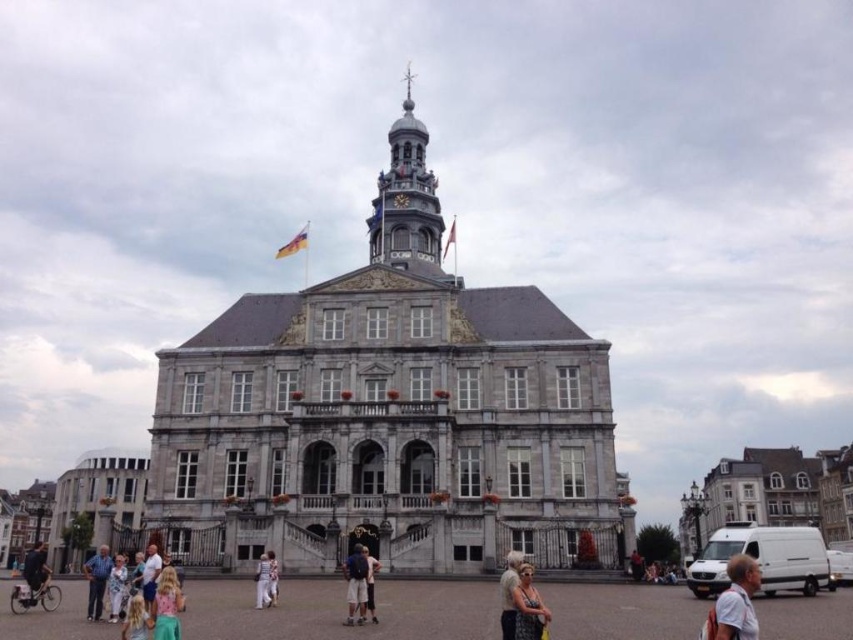
Between dark gray textured dress at lower center and light blue denim jeans at lower left, which one has more height?

light blue denim jeans at lower left is taller.

Between point (532, 627) and point (96, 589), which one is positioned in front?

Positioned in front is point (532, 627).

At what (x,y) coordinates should I click in order to perform the action: click on dark gray textured dress at lower center. Please return your answer as a coordinate pair (x, y). The height and width of the screenshot is (640, 853). Looking at the image, I should click on (527, 608).

Is point (515, 618) farther from camera compared to point (36, 582)?

No, (515, 618) is closer to viewer.

Who is more distant from viewer, (541, 637) or (30, 596)?

The point (30, 596) is more distant.

You are a GUI agent. You are given a task and a screenshot of the screen. Output one action in this format:
    pyautogui.click(x=<x>, y=<y>)
    Task: Click on the dark gray textured dress at lower center
    Image resolution: width=853 pixels, height=640 pixels.
    Given the screenshot: What is the action you would take?
    pyautogui.click(x=527, y=608)

You are a GUI agent. You are given a task and a screenshot of the screen. Output one action in this format:
    pyautogui.click(x=<x>, y=<y>)
    Task: Click on the dark gray textured dress at lower center
    The image size is (853, 640).
    Given the screenshot: What is the action you would take?
    pyautogui.click(x=527, y=608)

Can you confirm if dark gray textured dress at lower center is taller than white cotton dress at center?

No, dark gray textured dress at lower center is not taller than white cotton dress at center.

Is dark gray textured dress at lower center thinner than white cotton dress at center?

Indeed, dark gray textured dress at lower center has a lesser width compared to white cotton dress at center.

Does point (515, 621) come closer to viewer compared to point (265, 566)?

That is True.

Locate an element on the screen. The height and width of the screenshot is (640, 853). dark gray textured dress at lower center is located at coordinates (527, 608).